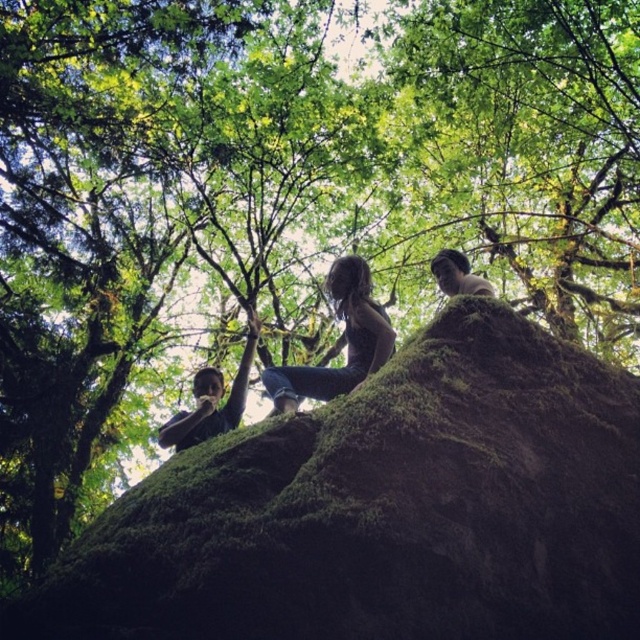
You are a photographer trying to capture a clear shot of the denim jeans at center and the dark brown leather jacket at center from below. Which object will appear closer to the camera in the photo?

The denim jeans at center is in front of the dark brown leather jacket at center, so it will appear closer to the camera in the photo.

You are standing below the large rock formation and looking up at the two people wearing denim jeans at center and dark brown leather jacket at center. Which clothing item is positioned higher from your viewpoint?

The denim jeans at center is located above the dark brown leather jacket at center, so the denim jeans at center is positioned higher from your viewpoint.